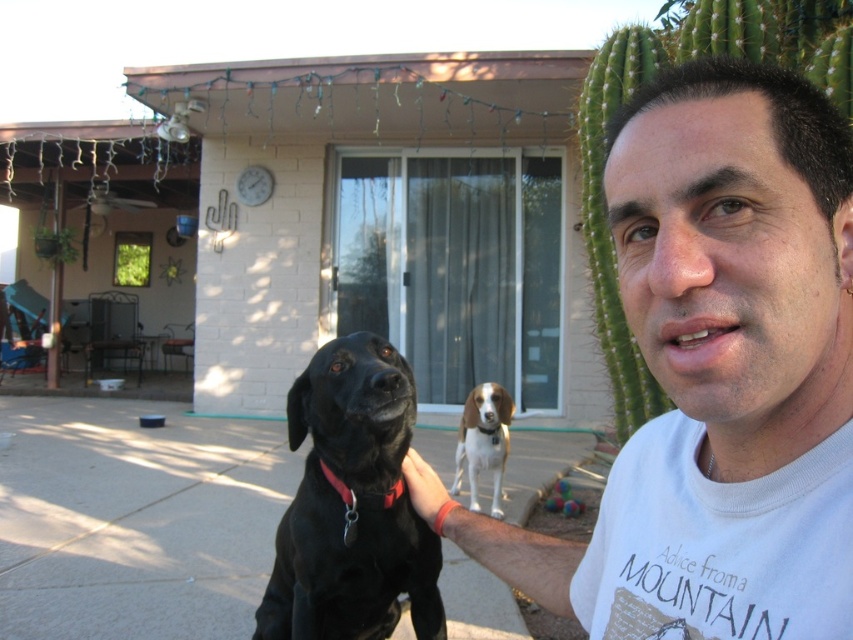
Question: Is the position of shiny black dog at center more distant than that of brown and white fur dog at center?

Choices:
 (A) yes
 (B) no

Answer: (B)

Question: Which object is closer to the camera taking this photo?

Choices:
 (A) brown and white fur dog at center
 (B) green spiny cactus at right
 (C) matte white t-shirt at center

Answer: (C)

Question: Can you confirm if green spiny cactus at right is positioned above brown and white fur dog at center?

Choices:
 (A) yes
 (B) no

Answer: (A)

Question: Which point is farther to the camera?

Choices:
 (A) (503, 452)
 (B) (624, 404)
 (C) (334, 358)

Answer: (A)

Question: Does matte white t-shirt at center appear under green spiny cactus at right?

Choices:
 (A) no
 (B) yes

Answer: (B)

Question: Which object is the farthest from the brown and white fur dog at center?

Choices:
 (A) matte white t-shirt at center
 (B) shiny black dog at center

Answer: (A)